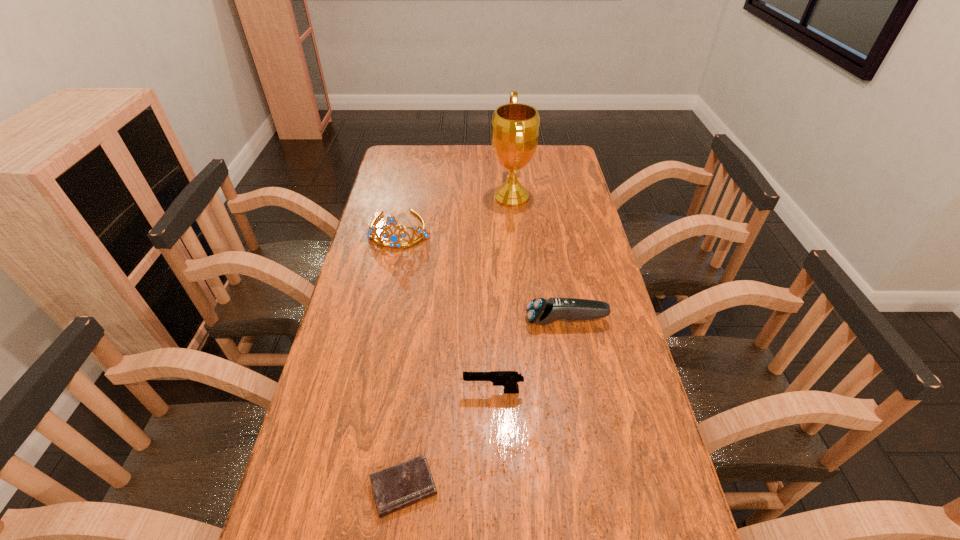
You are a GUI agent. You are given a task and a screenshot of the screen. Output one action in this format:
    pyautogui.click(x=<x>, y=<y>)
    Task: Click on the award
    
    Given the screenshot: What is the action you would take?
    pyautogui.click(x=515, y=127)

Find the location of `tiara`. tiara is located at coordinates (395, 241).

The width and height of the screenshot is (960, 540). Find the location of `electric shaver`. electric shaver is located at coordinates (540, 311).

You are a GUI agent. You are given a task and a screenshot of the screen. Output one action in this format:
    pyautogui.click(x=<x>, y=<y>)
    Task: Click on the pistol
    
    Given the screenshot: What is the action you would take?
    click(508, 379)

The height and width of the screenshot is (540, 960). I want to click on the shortest object, so click(x=397, y=487).

The height and width of the screenshot is (540, 960). Identify the location of the nearest object. (397, 487).

Where is `free space located 0.340m on the front-facing side of the award`? The image size is (960, 540). free space located 0.340m on the front-facing side of the award is located at coordinates (402, 197).

The image size is (960, 540). Find the location of `free space located on the front-facing side of the award`. free space located on the front-facing side of the award is located at coordinates (399, 197).

Image resolution: width=960 pixels, height=540 pixels. Find the location of `vacant space located 0.350m on the front-facing side of the award`. vacant space located 0.350m on the front-facing side of the award is located at coordinates (399, 197).

I want to click on vacant area situated 0.210m on the front-facing side of the tiara, so click(x=386, y=296).